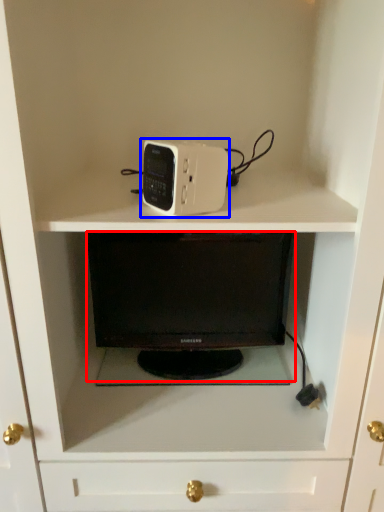
Question: Which point is closer to the camera, desktop (highlighted by a red box) or home appliance (highlighted by a blue box)?

Choices:
 (A) desktop
 (B) home appliance

Answer: (B)